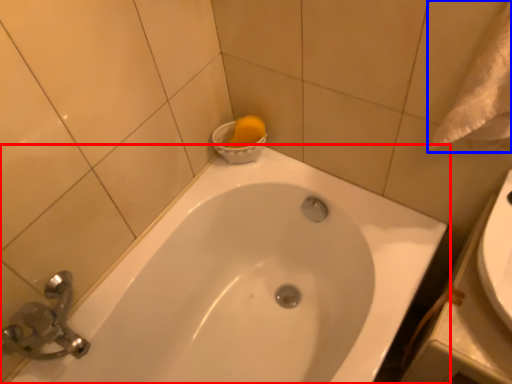
Question: Which object is further to the camera taking this photo, bathtub (highlighted by a red box) or bath towel (highlighted by a blue box)?

Choices:
 (A) bathtub
 (B) bath towel

Answer: (A)